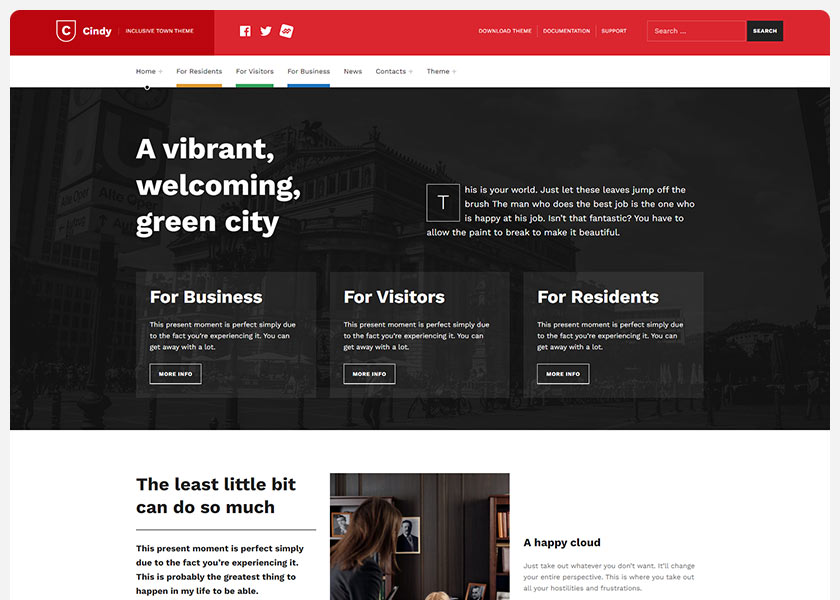
Where is `wall`? wall is located at coordinates (453, 532).